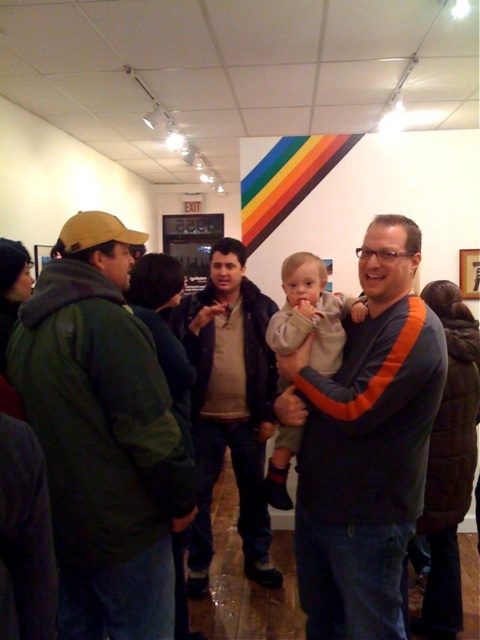
Question: Is orange-striped sweater at center closer to camera compared to light gray fleece at center?

Choices:
 (A) yes
 (B) no

Answer: (A)

Question: Which of the following is the farthest from the observer?

Choices:
 (A) (195, 380)
 (B) (290, 269)
 (C) (398, 497)

Answer: (A)

Question: Which point is closer to the camera taking this photo?

Choices:
 (A) (295, 268)
 (B) (416, 483)
 (C) (212, 342)

Answer: (B)

Question: Where is orange-striped sweater at center located in relation to dark brown leather jacket at center in the image?

Choices:
 (A) left
 (B) right

Answer: (B)

Question: Is dark brown leather jacket at center to the left of light gray fleece at center from the viewer's perspective?

Choices:
 (A) no
 (B) yes

Answer: (B)

Question: Among these points, which one is nearest to the camera?

Choices:
 (A) 67,440
 (B) 328,291

Answer: (A)